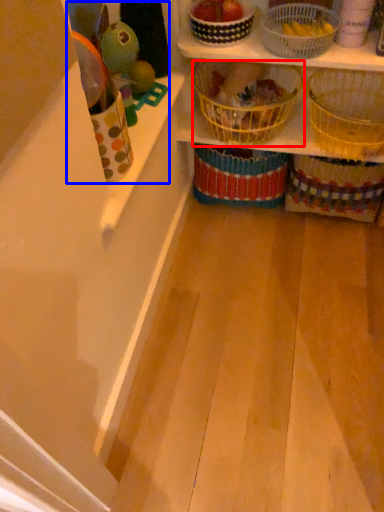
Question: Which object is further to the camera taking this photo, basket (highlighted by a red box) or toy (highlighted by a blue box)?

Choices:
 (A) basket
 (B) toy

Answer: (A)